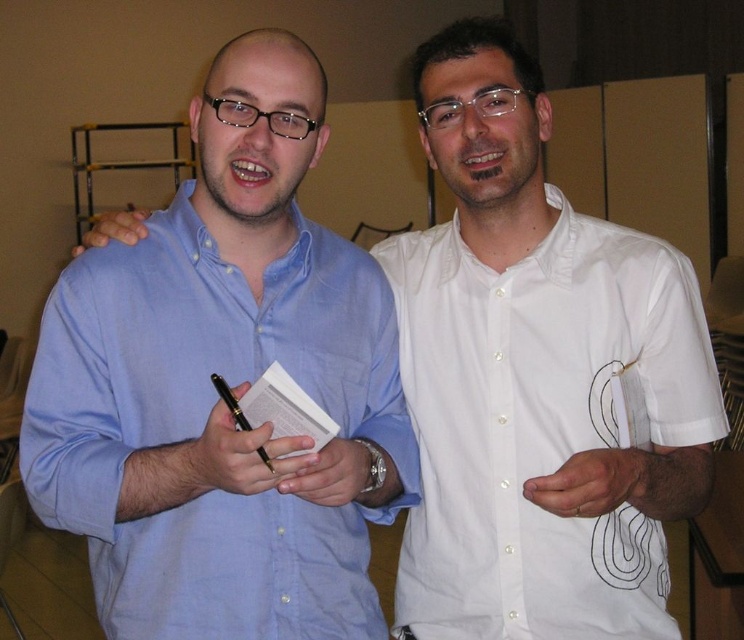
Consider the image. You are a photographer at a social event. You need to capture a photo of both the white cotton shirt at right and the metallic wristwatch at center. Based on their positions, which object should you focus on first to ensure both are in the frame?

The white cotton shirt at right is positioned on the right side of the metallic wristwatch at center, so you should focus on the metallic wristwatch at center first to ensure both are in the frame.

You are organizing a photo album and need to identify the position of the matte blue shirt at left in the image. What are its coordinates?

The matte blue shirt at left is located at coordinates point (205,428).

From the picture: You are attending a networking event and want to introduce yourself to someone. You see the matte blue shirt at left and the metallic wristwatch at center. Which one is closer to your line of sight?

The metallic wristwatch at center is closer to your line of sight because the matte blue shirt at left is taller than it, meaning the shirt is positioned further back.